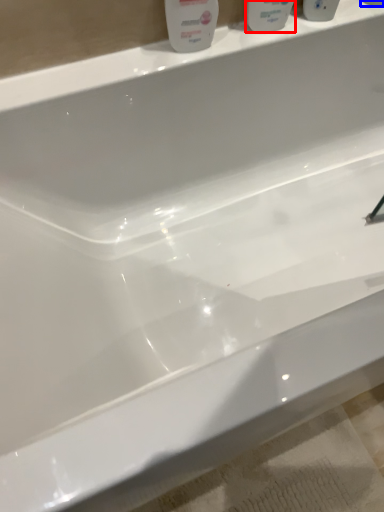
Question: Which object is further to the camera taking this photo, mouthwash (highlighted by a red box) or mouthwash (highlighted by a blue box)?

Choices:
 (A) mouthwash
 (B) mouthwash

Answer: (B)